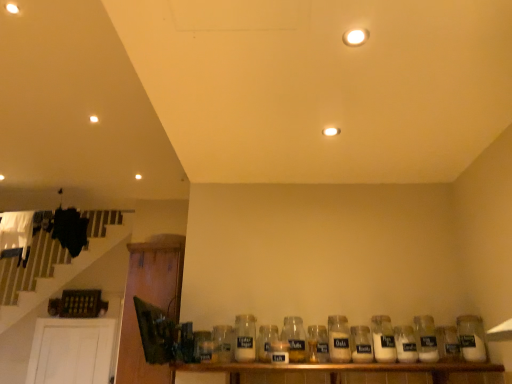
Locate an element on the screen. The width and height of the screenshot is (512, 384). free space in front of clear glass jar at center, which ranks as the second bottle in left-to-right order is located at coordinates (241, 364).